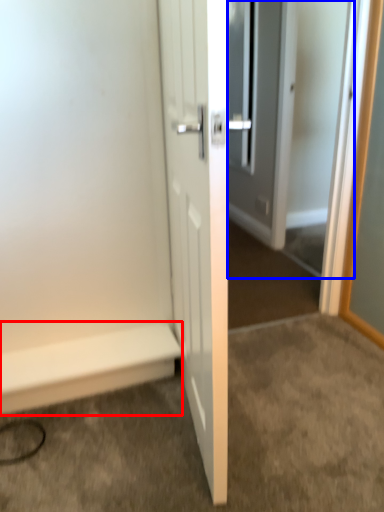
Question: Among these objects, which one is farthest to the camera, stairwell (highlighted by a red box) or screen door (highlighted by a blue box)?

Choices:
 (A) stairwell
 (B) screen door

Answer: (A)